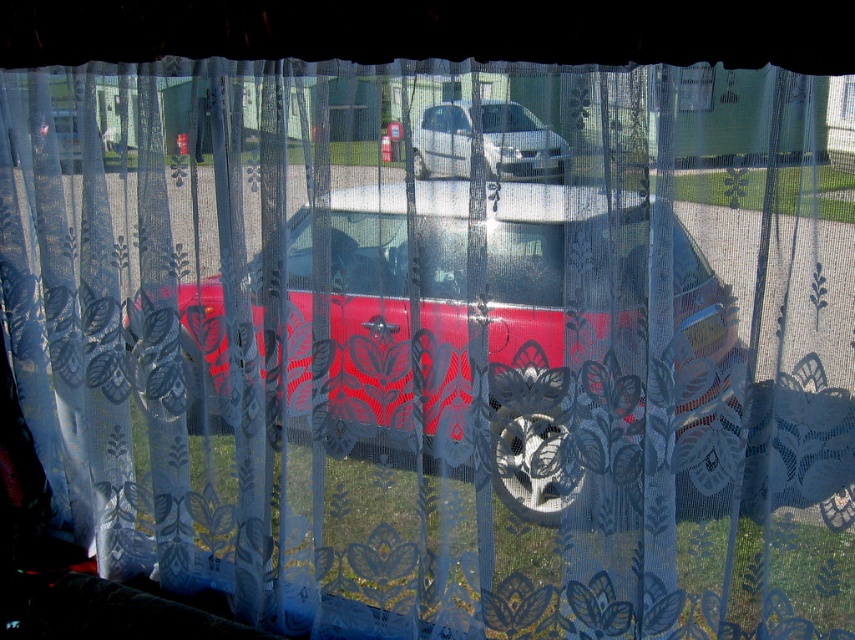
You are looking through the lace curtain and want to determine which of the two points, point [189,404] or point [511,148], is closer to you. Based on the image, which point is nearer?

Point [189,404] is further to the camera than point [511,148], so the closer point to you is point [511,148].

You are standing in front of a window with a lace curtain. You see a point marked at coordinates (373, 316). What object is located at that point?

The point at (373, 316) indicates the shiny metallic car at center.